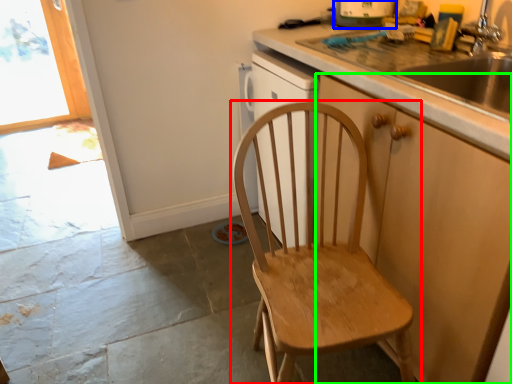
Question: Which object is the closest to the chair (highlighted by a red box)? Choose among these: kitchen appliance (highlighted by a blue box) or cabinetry (highlighted by a green box).

Choices:
 (A) kitchen appliance
 (B) cabinetry

Answer: (B)